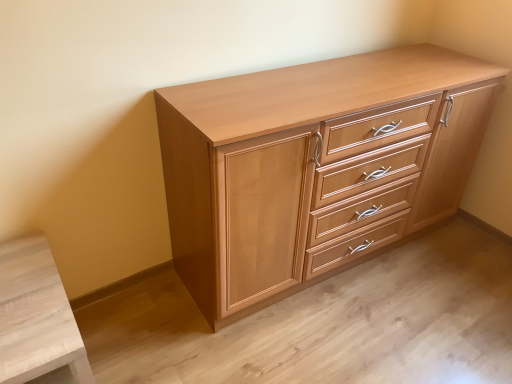
In order to click on empty space that is ontop of light wood cabinet at lower left (from a real-world perspective) in this screenshot , I will do `click(26, 295)`.